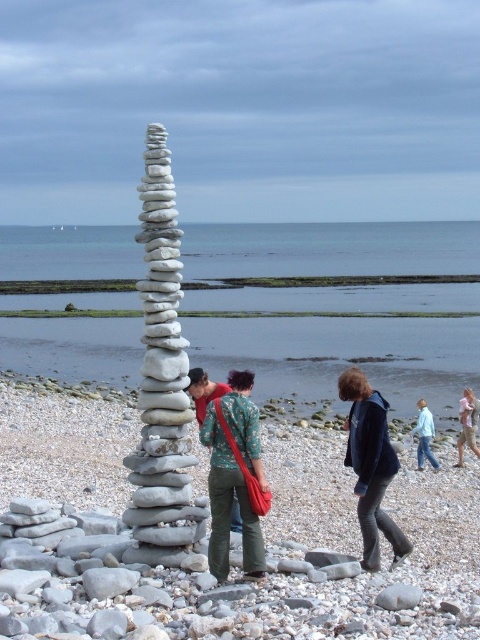
You are standing on the pebble beach and want to find the point marked at coordinates (162,372). According to the scene description, where would you look to find this point?

The point marked at coordinates (162,372) is located on the white smooth stones at center.

You are a photographer trying to capture a clear shot of both the white smooth stones at center and the green camouflage shirt at center. Which object should you focus on first if you want to ensure both are in focus?

The white smooth stones at center are taller than the green camouflage shirt at center. To ensure both are in focus, focus on the white smooth stones at center first since it is taller and occupies more space in the frame.